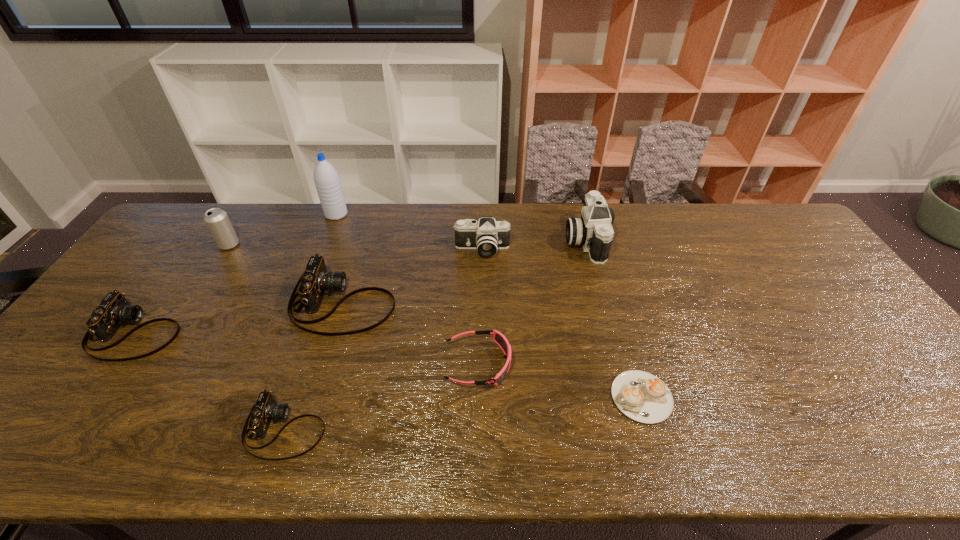
Locate an element on the screen. The image size is (960, 540). vacant region located on the front-facing side of the fifth shortest object is located at coordinates (459, 302).

Identify the location of free spot located 0.310m on the front-facing side of the second smallest brown camera. (296, 332).

In order to click on free location located 0.170m on the front-facing side of the goggles in this screenshot , I will do `click(578, 363)`.

Identify the location of blank space located 0.060m on the front-facing side of the smallest brown camera. Image resolution: width=960 pixels, height=540 pixels. (x=352, y=428).

The image size is (960, 540). Identify the location of vacant space located on the front of the shortest object. (657, 446).

I want to click on water bottle situated at the far edge, so click(x=326, y=178).

Locate an element on the screen. This screenshot has width=960, height=540. beer can that is positioned at the far edge is located at coordinates (217, 221).

Find the location of `camera situated at the near edge`. camera situated at the near edge is located at coordinates (265, 410).

Locate an element on the screen. The width and height of the screenshot is (960, 540). cappuccino present at the near edge is located at coordinates (643, 397).

At what (x,y) coordinates should I click in order to perform the action: click on object situated at the left edge. Please return your answer as a coordinate pair (x, y). Looking at the image, I should click on (114, 310).